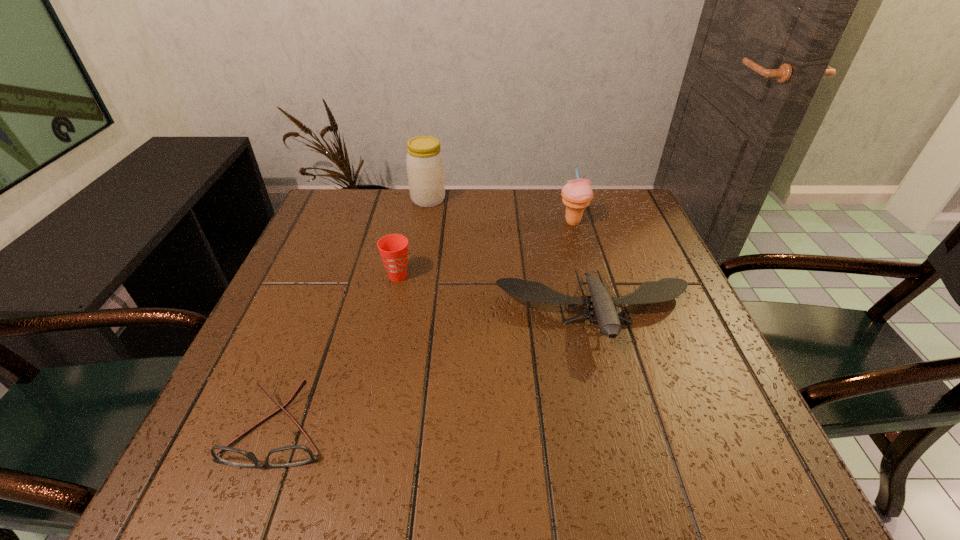
I want to click on free spot between the fourth nearest object and the shortest object, so click(426, 326).

Locate an element on the screen. This screenshot has height=540, width=960. vacant area between the third tallest object and the farthest object is located at coordinates pyautogui.click(x=413, y=238).

Find the location of `vacant area that lies between the second tallest object and the shortest object`. vacant area that lies between the second tallest object and the shortest object is located at coordinates (426, 326).

The image size is (960, 540). Find the location of `free area in between the third tallest object and the fourth nearest object`. free area in between the third tallest object and the fourth nearest object is located at coordinates (486, 249).

Select which object is the second closest to the shortest object. Please provide its 2D coordinates. Your answer should be formatted as a tuple, i.e. [(x, y)], where the tuple contains the x and y coordinates of a point satisfying the conditions above.

[(665, 289)]

The width and height of the screenshot is (960, 540). I want to click on object that ranks as the closest to the drone, so pyautogui.click(x=577, y=194).

Find the location of `vacant space that satisfies the following two spatial constraints: 1. on the front side of the jar; 2. on the left side of the icecream`. vacant space that satisfies the following two spatial constraints: 1. on the front side of the jar; 2. on the left side of the icecream is located at coordinates tap(424, 222).